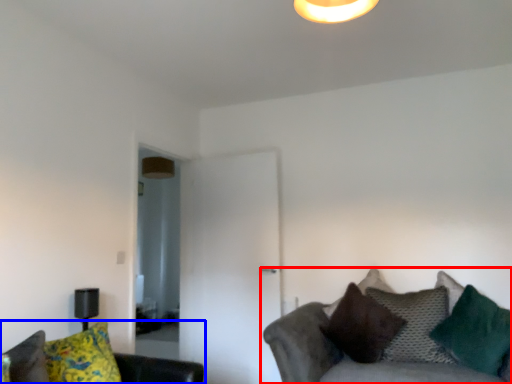
Question: Which of the following is the closest to the observer, studio couch (highlighted by a red box) or studio couch (highlighted by a blue box)?

Choices:
 (A) studio couch
 (B) studio couch

Answer: (B)